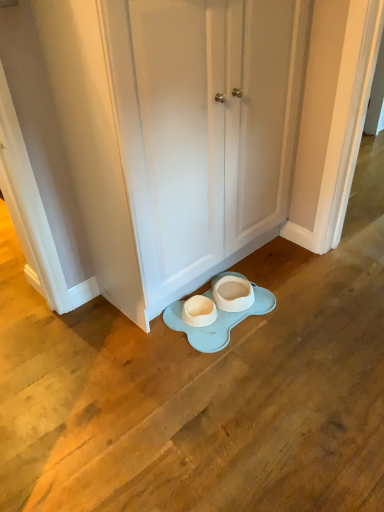
Image resolution: width=384 pixels, height=512 pixels. Identify the location of vacant space situated on the left part of white matte door at center. (108, 337).